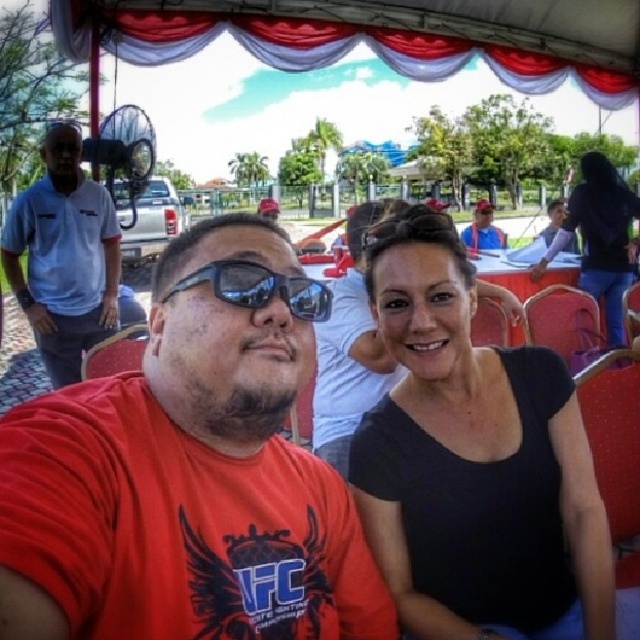
You are organizing a clothing display and need to arrange the light blue cotton polo shirt at left and the black plastic sunglasses at center based on their sizes. Which item should be placed first if you want to arrange them from largest to smallest?

The light blue cotton polo shirt at left should be placed first since it is wider than the black plastic sunglasses at center, making it the larger item.

You are organizing a photo shoot and need to ensure that all clothing items are visible in the frame. Given the light blue cotton polo shirt at left and the black plastic sunglasses at center, which item will require more space in the camera frame?

The light blue cotton polo shirt at left is larger in size than the black plastic sunglasses at center, so it will require more space in the camera frame.